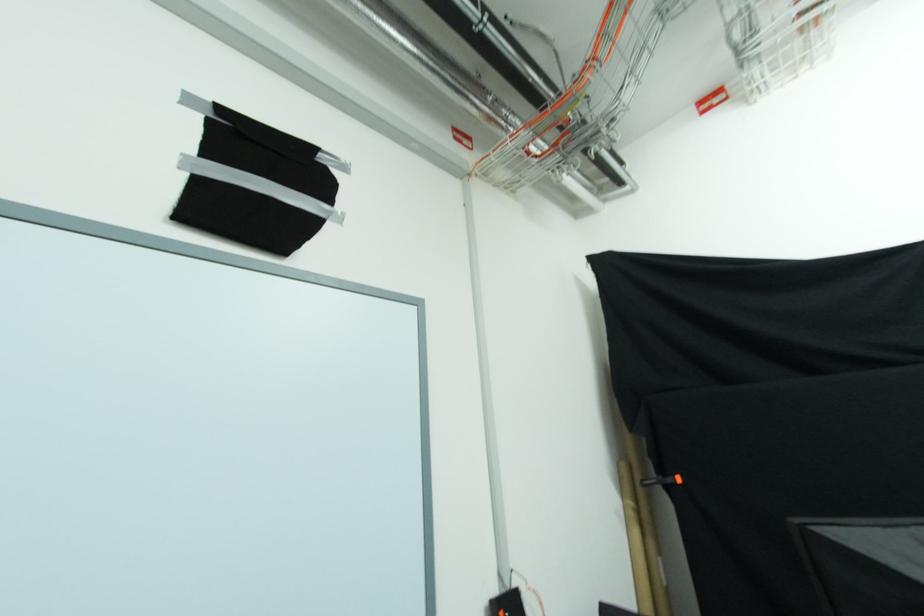
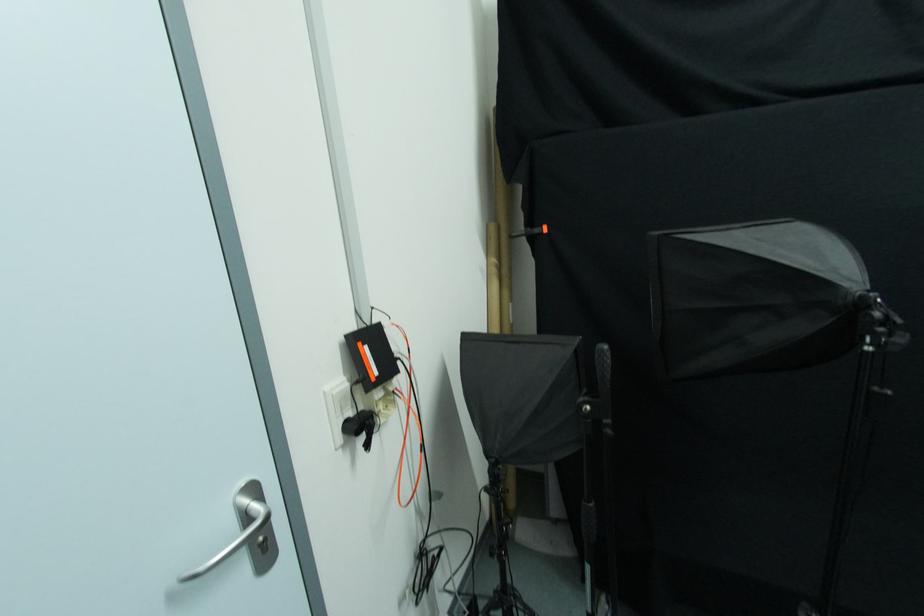
The first image is from the beginning of the video and the second image is from the end. How did the camera likely rotate when shooting the video?

The camera rotated toward right-down.